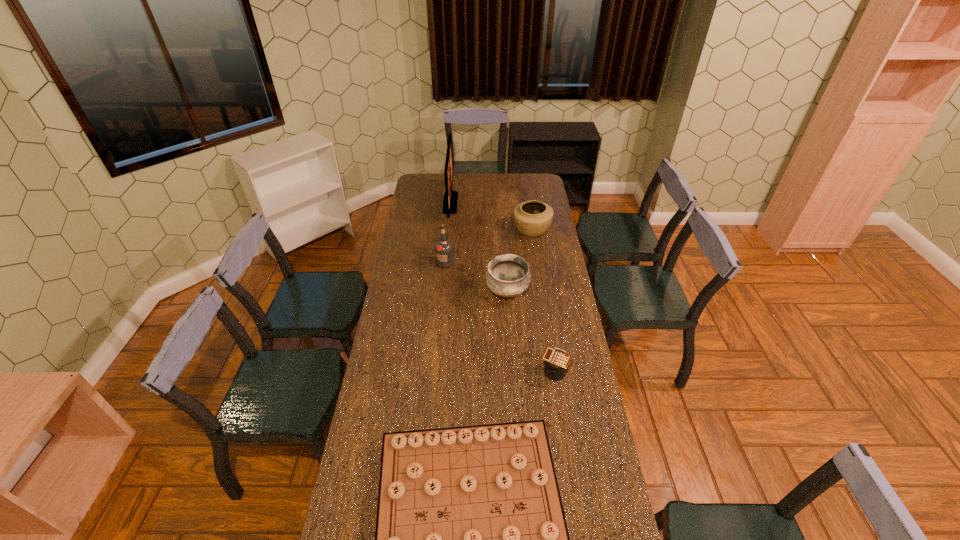
At what (x,y) coordinates should I click in order to perform the action: click on vacant area located on the left of the farther pottery. Please return your answer as a coordinate pair (x, y). Looking at the image, I should click on (447, 230).

Locate an element on the screen. Image resolution: width=960 pixels, height=540 pixels. blank space located 0.170m on the back of the fifth farthest object is located at coordinates (547, 326).

Locate an element on the screen. The height and width of the screenshot is (540, 960). object at the far edge is located at coordinates (450, 197).

Find the location of a particular element. The image size is (960, 540). pottery at the right edge is located at coordinates (533, 218).

I want to click on calculator that is at the right edge, so click(556, 360).

Where is `blank area at the far edge`? blank area at the far edge is located at coordinates (444, 183).

The height and width of the screenshot is (540, 960). In the image, there is a desktop. Find the location of `vacant space at the left edge`. vacant space at the left edge is located at coordinates (408, 287).

Locate an element on the screen. This screenshot has width=960, height=540. vacant region at the right edge of the desktop is located at coordinates (564, 276).

At what (x,y) coordinates should I click in order to perform the action: click on free space between the monitor and the farther pottery. Please return your answer as a coordinate pair (x, y). The image size is (960, 540). Looking at the image, I should click on (492, 217).

Image resolution: width=960 pixels, height=540 pixels. I want to click on vacant area that lies between the fifth farthest object and the farther pottery, so click(543, 300).